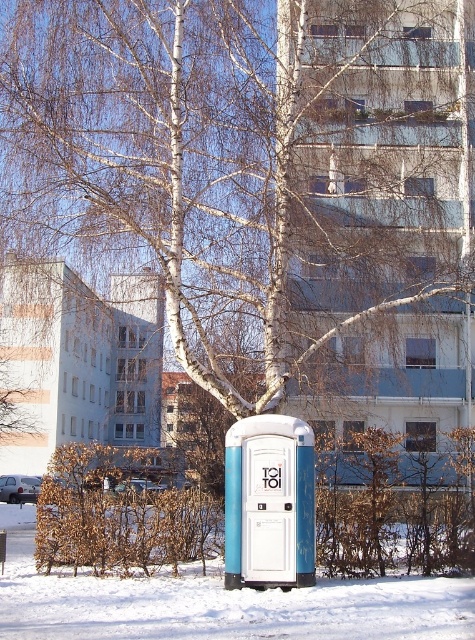
You are standing at the portable toilet with the blue and white color scheme in the snowy urban scene. You notice two points marked on the ground in front of you. The first point is at coordinates point (395, 588) and the second is at point (247, 467). Which point is closer to you?

Point (395, 588) is in front of point (247, 467), so the first point is closer to you.

You are a city planner analyzing the layout of this snowy area. You need to determine if the blue plastic toilet at center can be moved closer to the brown leafy shrub at lower left without overlapping. Based on their widths, is this feasible?

The brown leafy shrub at lower left is wider than the blue plastic toilet at center. Since the shrub is wider, moving the toilet closer might cause overlap unless there is sufficient space between them. However, the exact distance isn

You are a delivery person trying to place a package on the ground between the white powdery snow at lower center and the brown leafy shrub at lower left. Can you tell me which direction you should move the package so it stays on the snow?

The white powdery snow at lower center is in front of the brown leafy shrub at lower left, so you should move the package towards the direction of the shrub to keep it on the snow.